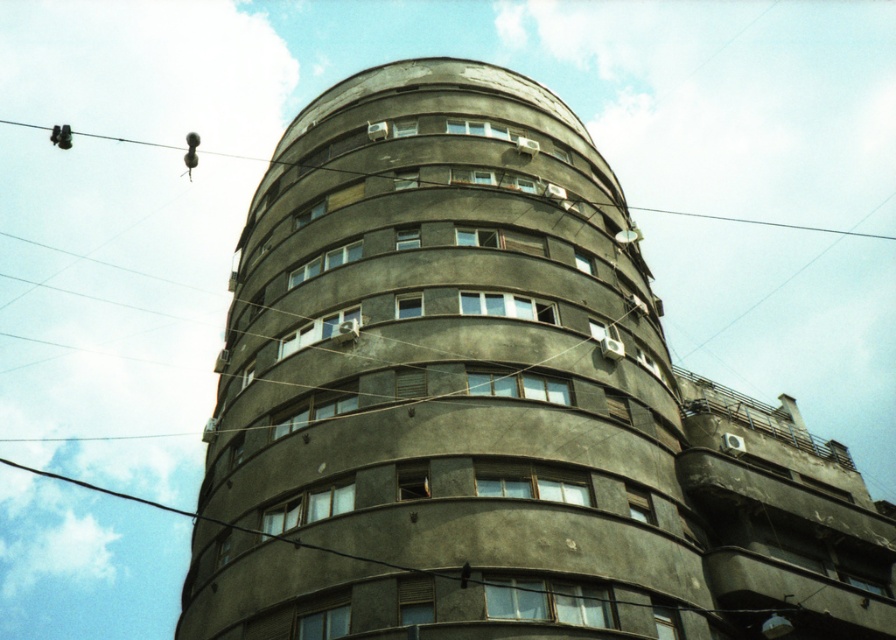
You are an architect analyzing the building layout. From your vantage point, does the dark gray concrete building at center extend above the metallic wire at upper center?

The dark gray concrete building at center is located below the metallic wire at upper center, so it does not extend above it.

You are standing in front of the dark gray concrete building at center and looking upwards. Can you see the metallic wire at upper center above the building?

Yes, the metallic wire at upper center is taller than the dark gray concrete building at center, so it can be seen above the building.

You are standing in front of a multi story building with a curved facade. You see a point marked at coordinates (442, 384). What does this point indicate?

The point at (442, 384) indicates the location of the dark gray concrete building at center.